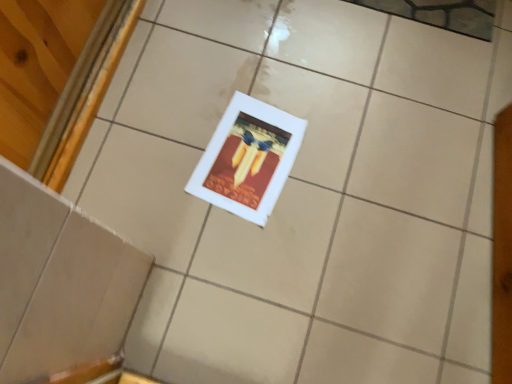
Question: Should I look upward or downward to see white matte picture frame at center?

Choices:
 (A) down
 (B) up

Answer: (B)